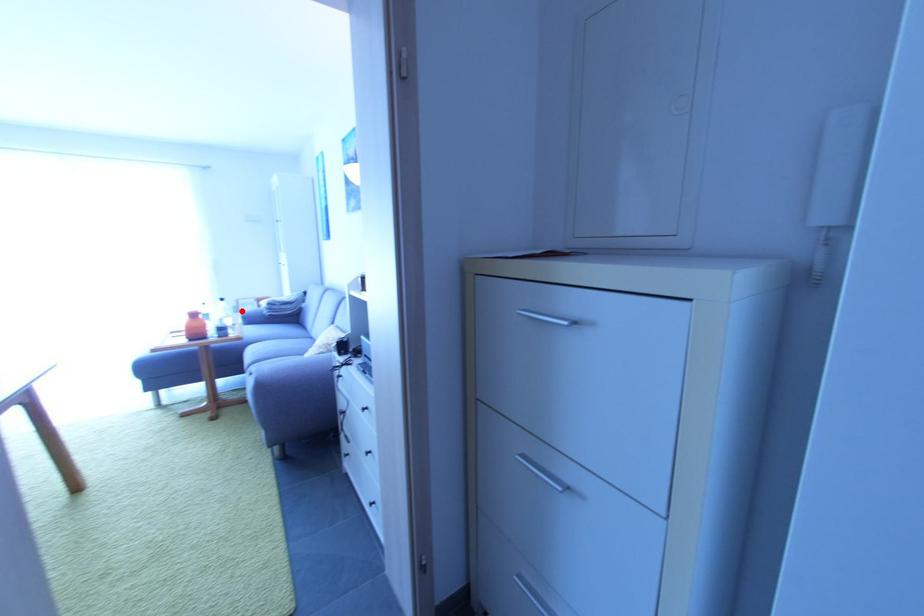
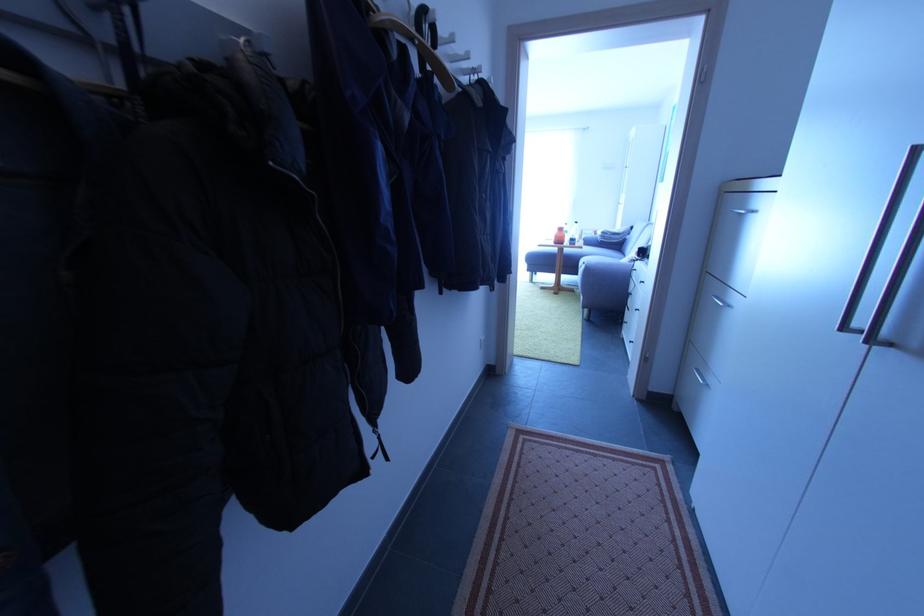
Question: I am providing you with two images of the same scene from different viewpoints. Image1 has a red point marked. In image2, the corresponding 3D location appears at what relative position? Reply with the corresponding letter.

Choices:
 (A) Closer
 (B) Farther

Answer: (A)